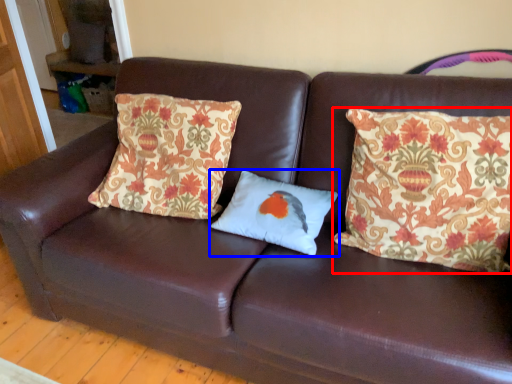
Question: Among these objects, which one is nearest to the camera, pillow (highlighted by a red box) or pillow (highlighted by a blue box)?

Choices:
 (A) pillow
 (B) pillow

Answer: (A)